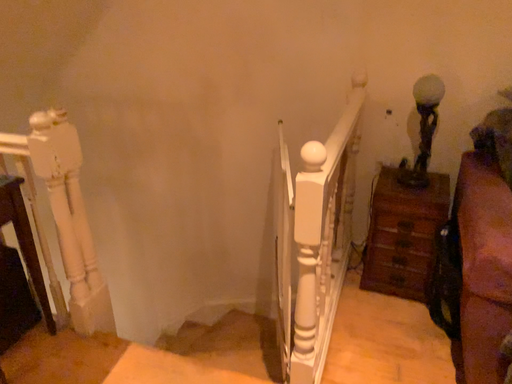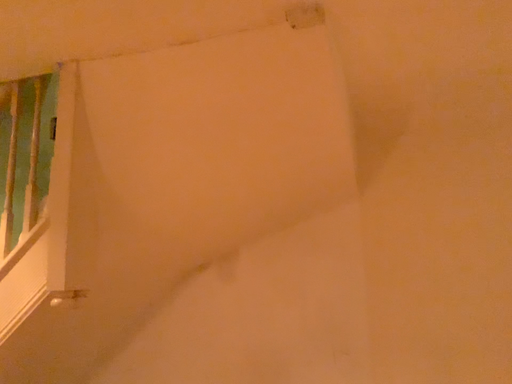
Question: Which way did the camera rotate in the video?

Choices:
 (A) rotated downward
 (B) rotated upward

Answer: (B)